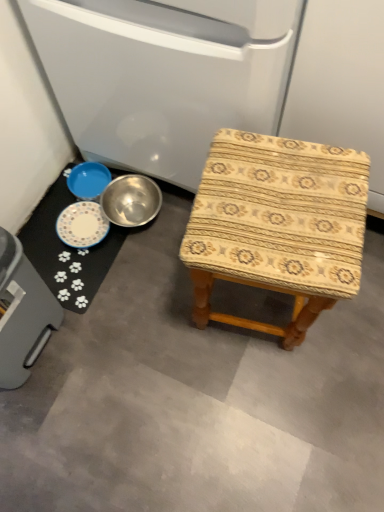
Question: Is white paw print mat at lower left positioned in front of gray plastic trash can at lower left, which is counted as the first appliance, starting from the left?

Choices:
 (A) yes
 (B) no

Answer: (B)

Question: Can you confirm if white paw print mat at lower left is positioned to the right of gray plastic trash can at lower left, which ranks as the first appliance in bottom-to-top order?

Choices:
 (A) no
 (B) yes

Answer: (B)

Question: Does white paw print mat at lower left come behind gray plastic trash can at lower left, which is counted as the first appliance, starting from the left?

Choices:
 (A) yes
 (B) no

Answer: (A)

Question: From a real-world perspective, is white paw print mat at lower left below gray plastic trash can at lower left, acting as the second appliance starting from the top?

Choices:
 (A) yes
 (B) no

Answer: (A)

Question: Does white paw print mat at lower left have a greater height compared to gray plastic trash can at lower left, acting as the second appliance starting from the top?

Choices:
 (A) yes
 (B) no

Answer: (B)

Question: From a real-world perspective, relative to metallic bowl at lower left, acting as the second appliance starting from the bottom, is wooden-patterned stool at center vertically above or below?

Choices:
 (A) below
 (B) above

Answer: (A)

Question: Is point (253, 198) positioned closer to the camera than point (221, 108)?

Choices:
 (A) closer
 (B) farther

Answer: (A)

Question: Is wooden-patterned stool at center spatially inside metallic bowl at lower left, the 1th appliance when ordered from top to bottom, or outside of it?

Choices:
 (A) outside
 (B) inside

Answer: (A)

Question: Is wooden-patterned stool at center in front of or behind metallic bowl at lower left, which ranks as the 1th appliance in right-to-left order, in the image?

Choices:
 (A) behind
 (B) front

Answer: (B)

Question: Does point (43, 284) appear closer or farther from the camera than point (94, 251)?

Choices:
 (A) farther
 (B) closer

Answer: (B)

Question: Visually, is gray plastic trash can at lower left, acting as the second appliance starting from the top, positioned to the left or to the right of white paw print mat at lower left?

Choices:
 (A) left
 (B) right

Answer: (A)

Question: In terms of height, does gray plastic trash can at lower left, which ranks as the first appliance in bottom-to-top order, look taller or shorter compared to white paw print mat at lower left?

Choices:
 (A) tall
 (B) short

Answer: (A)

Question: From a real-world perspective, relative to white paw print mat at lower left, is gray plastic trash can at lower left, which is counted as the first appliance, starting from the left, vertically above or below?

Choices:
 (A) below
 (B) above

Answer: (B)

Question: In the image, is blue metallic bowl at lower left positioned in front of or behind gray plastic trash can at lower left, acting as the second appliance starting from the top?

Choices:
 (A) front
 (B) behind

Answer: (B)

Question: In terms of size, does blue metallic bowl at lower left appear bigger or smaller than gray plastic trash can at lower left, the 2th appliance when ordered from right to left?

Choices:
 (A) small
 (B) big

Answer: (A)